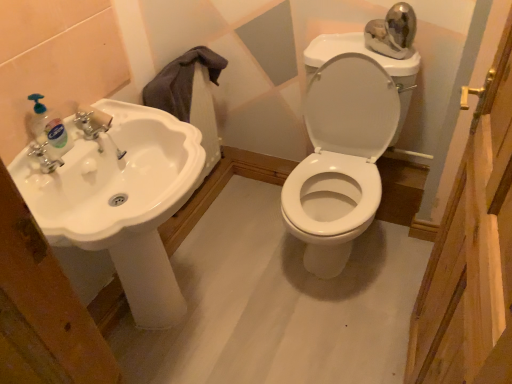
Question: Is white glossy toilet at center bigger or smaller than translucent plastic soap dispenser at left?

Choices:
 (A) small
 (B) big

Answer: (B)

Question: From a real-world perspective, is white glossy toilet at center physically located above or below translucent plastic soap dispenser at left?

Choices:
 (A) above
 (B) below

Answer: (B)

Question: Based on their relative distances, which object is farther from the white glossy toilet at center?

Choices:
 (A) white glossy sink at left
 (B) translucent plastic soap dispenser at left

Answer: (B)

Question: Which of these objects is positioned closest to the white glossy toilet at center?

Choices:
 (A) white glossy sink at left
 (B) translucent plastic soap dispenser at left

Answer: (A)